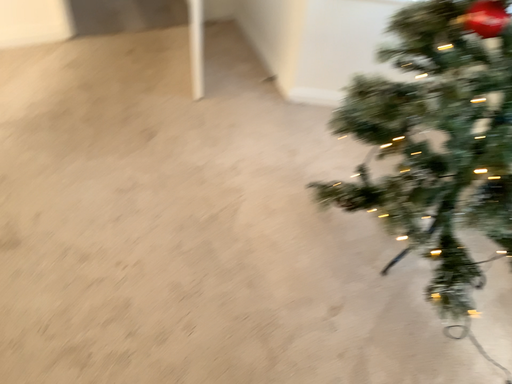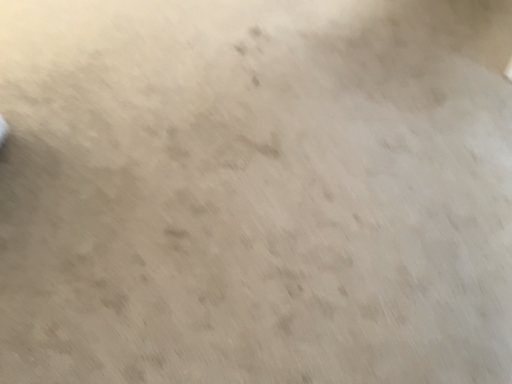
Question: How did the camera likely rotate when shooting the video?

Choices:
 (A) rotated right
 (B) rotated left

Answer: (B)